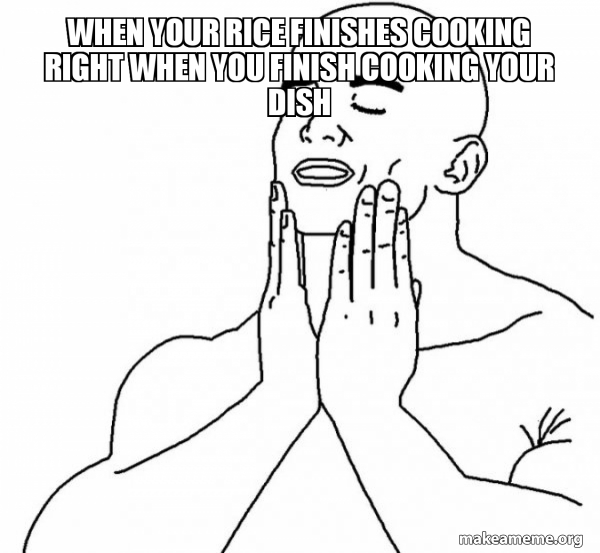
Locate an element on the screen. chest is located at coordinates (302, 487).